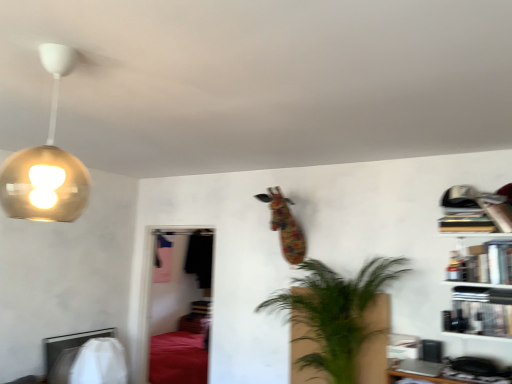
Image resolution: width=512 pixels, height=384 pixels. In order to click on free space above gold metallic globe at upper left (from a real-world perspective) in this screenshot , I will do `click(66, 47)`.